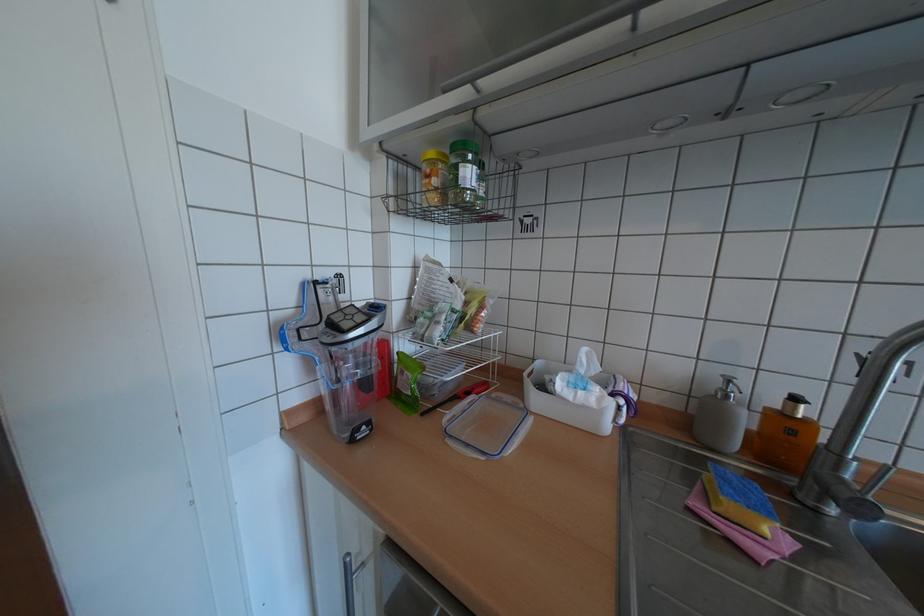
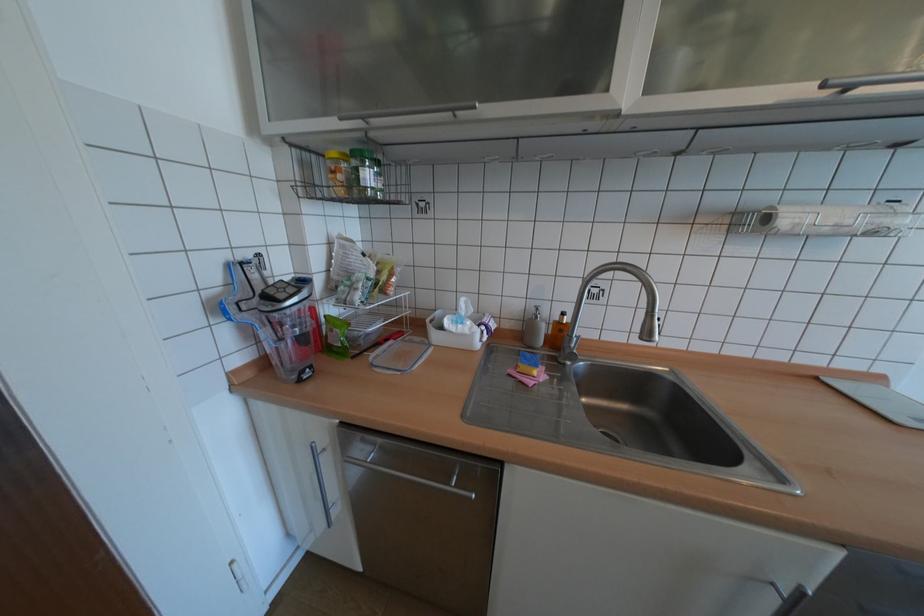
The point at (x=784, y=403) is marked in the first image. Where is the corresponding point in the second image?

(565, 317)